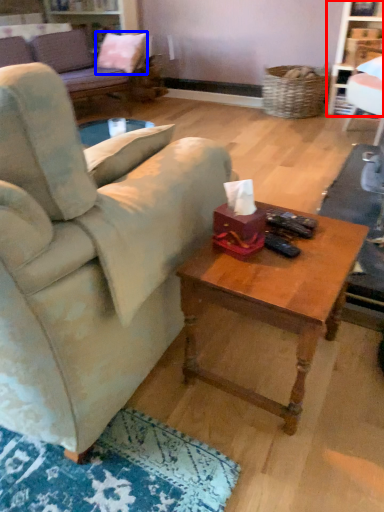
Question: Which of the following is the closest to the observer, bookshelf (highlighted by a red box) or pillow (highlighted by a blue box)?

Choices:
 (A) bookshelf
 (B) pillow

Answer: (A)